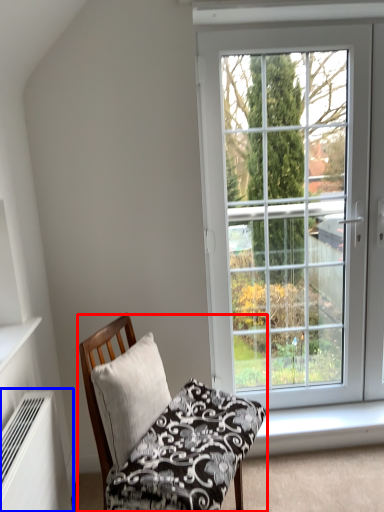
Question: Which object is further to the camera taking this photo, chair (highlighted by a red box) or air conditioner (highlighted by a blue box)?

Choices:
 (A) chair
 (B) air conditioner

Answer: (A)